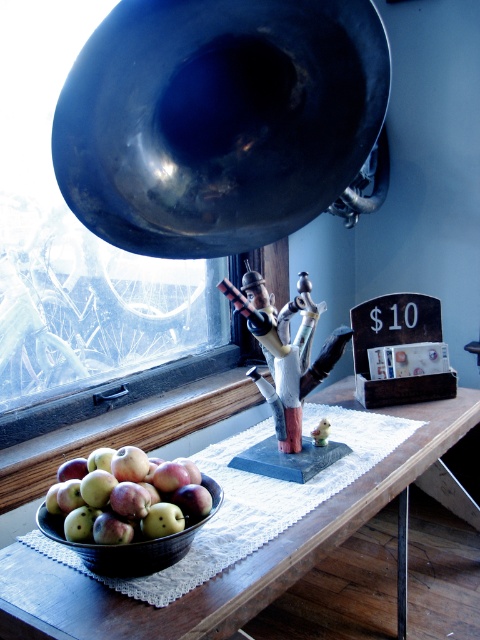
Question: Does shiny black trumpet at upper center come in front of wooden table at lower left?

Choices:
 (A) no
 (B) yes

Answer: (B)

Question: Estimate the real-world distances between objects in this image. Which object is farther from the wooden table at lower left?

Choices:
 (A) green matte apples at lower left
 (B) shiny black trumpet at upper center

Answer: (B)

Question: Does wooden table at lower left have a greater width compared to green matte apples at lower left?

Choices:
 (A) yes
 (B) no

Answer: (A)

Question: Among these points, which one is farthest from the camera?

Choices:
 (A) (x=429, y=438)
 (B) (x=249, y=196)

Answer: (A)

Question: Which point appears farthest from the camera in this image?

Choices:
 (A) click(x=24, y=582)
 (B) click(x=165, y=509)
 (C) click(x=141, y=232)

Answer: (A)

Question: Considering the relative positions of shiny black trumpet at upper center and green matte apples at lower left in the image provided, where is shiny black trumpet at upper center located with respect to green matte apples at lower left?

Choices:
 (A) above
 (B) below

Answer: (A)